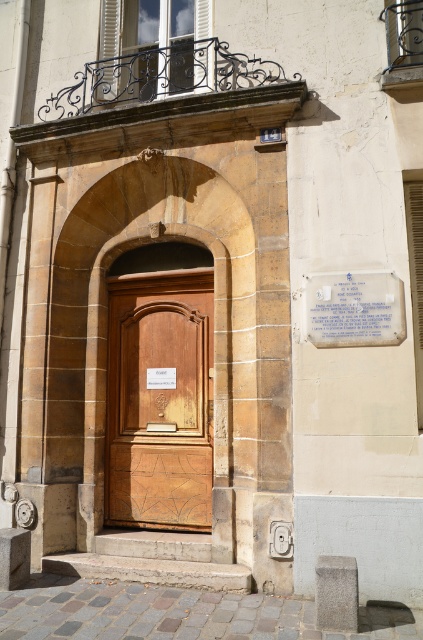
Can you confirm if wooden carved door at center is thinner than white paper plaque at upper right?

No, wooden carved door at center is not thinner than white paper plaque at upper right.

From the picture: Can you confirm if wooden carved door at center is positioned below white paper plaque at upper right?

Yes.

Who is more forward, (x=181, y=520) or (x=343, y=330)?

Point (x=343, y=330) is more forward.

At what (x,y) coordinates should I click in order to perform the action: click on wooden carved door at center. Please return your answer as a coordinate pair (x, y). The width and height of the screenshot is (423, 640). Looking at the image, I should click on (159, 400).